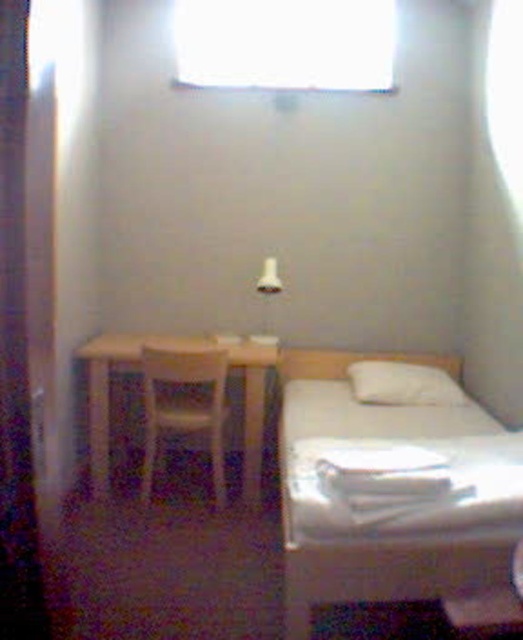
Is point (21, 540) less distant than point (400, 381)?

Yes, point (21, 540) is in front of point (400, 381).

Does white fabric curtain at left have a lesser height compared to white soft pillow at upper center?

No, white fabric curtain at left is not shorter than white soft pillow at upper center.

The image size is (523, 640). What do you see at coordinates (16, 353) in the screenshot? I see `white fabric curtain at left` at bounding box center [16, 353].

What are the coordinates of `white fabric curtain at left` in the screenshot? It's located at (16, 353).

Who is lower down, white fabric curtain at left or white plastic chair at left?

Positioned lower is white plastic chair at left.

Can you confirm if white fabric curtain at left is shorter than white plastic chair at left?

No.

Does point (25, 49) come behind point (162, 412)?

That is False.

Image resolution: width=523 pixels, height=640 pixels. Find the location of `white fabric curtain at left`. white fabric curtain at left is located at coordinates (16, 353).

Which is more to the left, transparent glass window at upper center or light wood table at center?

light wood table at center is more to the left.

Who is taller, transparent glass window at upper center or light wood table at center?

light wood table at center

You are a GUI agent. You are given a task and a screenshot of the screen. Output one action in this format:
    pyautogui.click(x=<x>, y=<y>)
    Task: Click on the transparent glass window at upper center
    
    Given the screenshot: What is the action you would take?
    pyautogui.click(x=286, y=44)